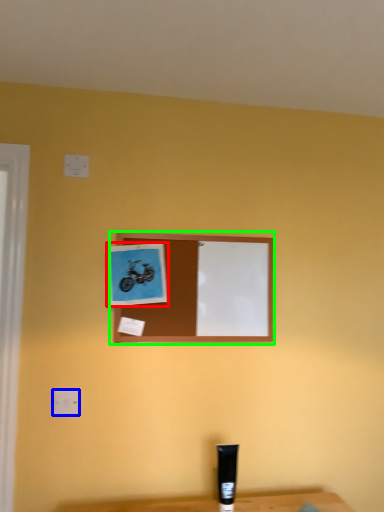
Question: Which object is the farthest from picture frame (highlighted by a red box)? Choose among these: electric outlet (highlighted by a blue box) or picture frame (highlighted by a green box).

Choices:
 (A) electric outlet
 (B) picture frame

Answer: (A)